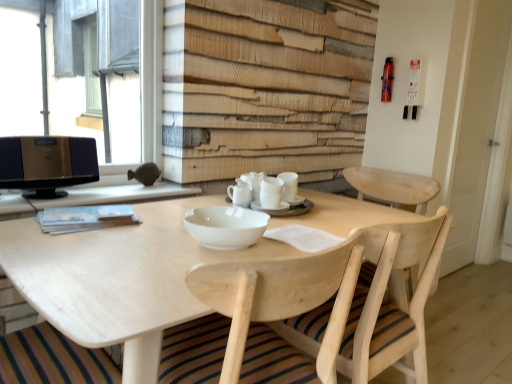
Question: From the image's perspective, is natural wood table at center located above or below white matte cups at center, the third tableware positioned from the left?

Choices:
 (A) above
 (B) below

Answer: (B)

Question: In terms of width, does natural wood table at center look wider or thinner when compared to white matte cups at center, the third tableware positioned from the left?

Choices:
 (A) wide
 (B) thin

Answer: (A)

Question: Considering the real-world distances, which object is closest to the white matte paper at left?

Choices:
 (A) white matte cups at center, the third tableware from the right
 (B) white ceramic cups at center, placed as the 2th tableware when sorted from right to left
 (C) white matte cups at center, the third tableware positioned from the left
 (D) light wood chair at center
 (E) metallic gray window at upper left

Answer: (A)

Question: Considering the real-world distances, which object is closest to the white ceramic cups at center, which is the 2th tableware in left-to-right order?

Choices:
 (A) white matte cups at center, the third tableware from the right
 (B) white matte cups at center, the third tableware positioned from the left
 (C) white matte paper at left
 (D) metallic gray window at upper left
 (E) light wood chair at center

Answer: (B)